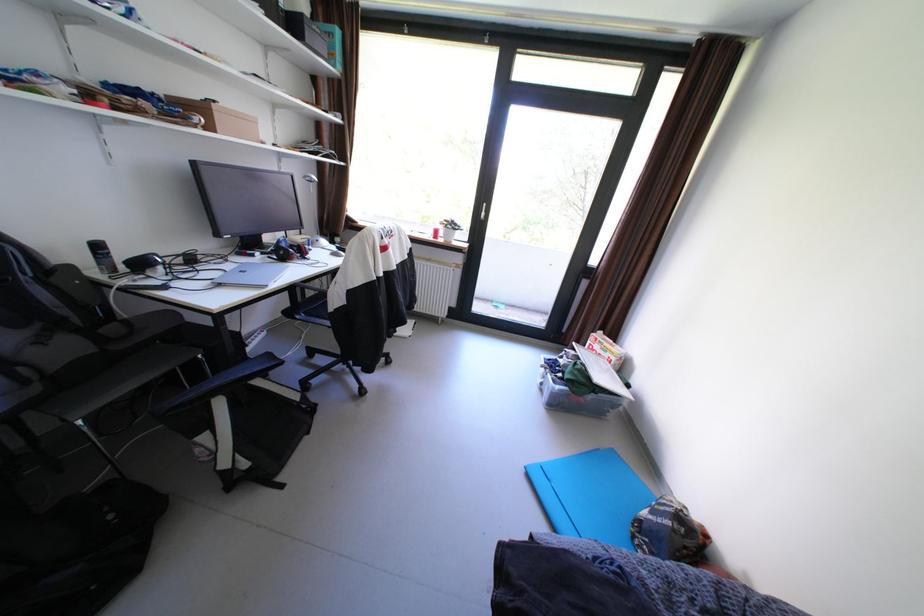
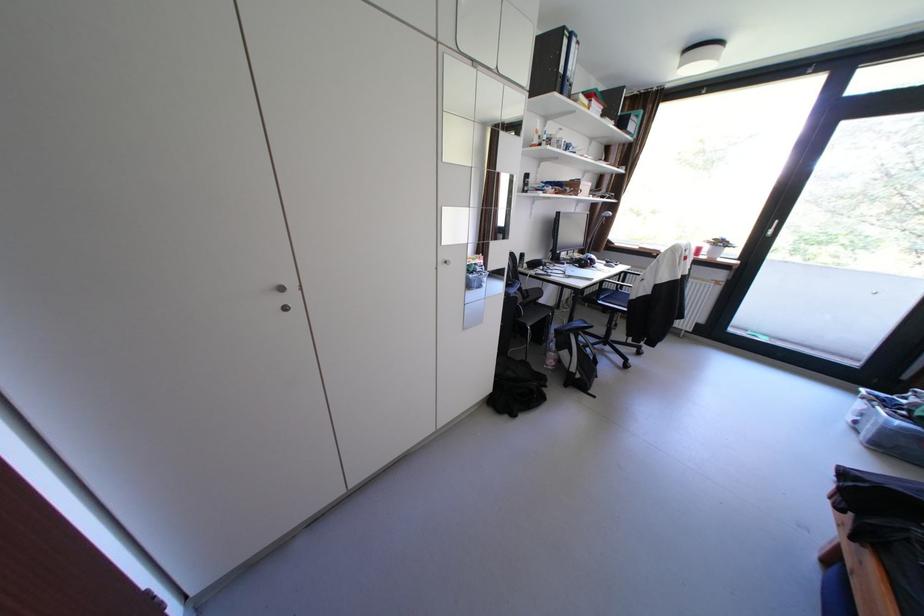
Find the pixel in the second image that matches the point at 263,256 in the first image.

(574, 264)